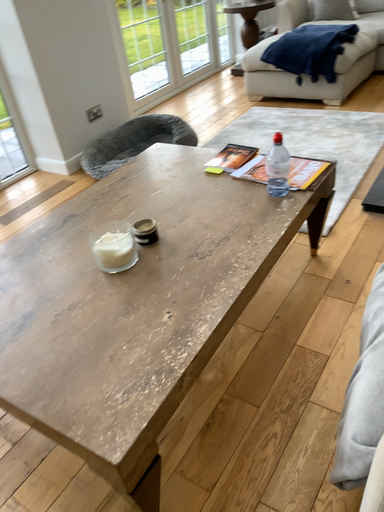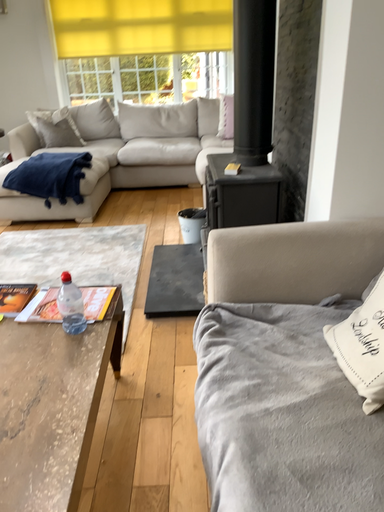
Question: Which way did the camera rotate in the video?

Choices:
 (A) rotated right
 (B) rotated left

Answer: (A)